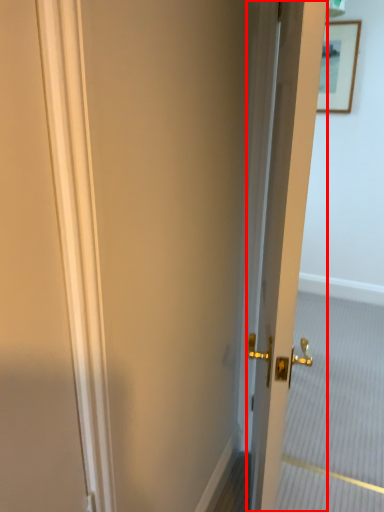
Question: In this image, where is door (annotated by the red box) located relative to picture frame?

Choices:
 (A) left
 (B) right

Answer: (A)